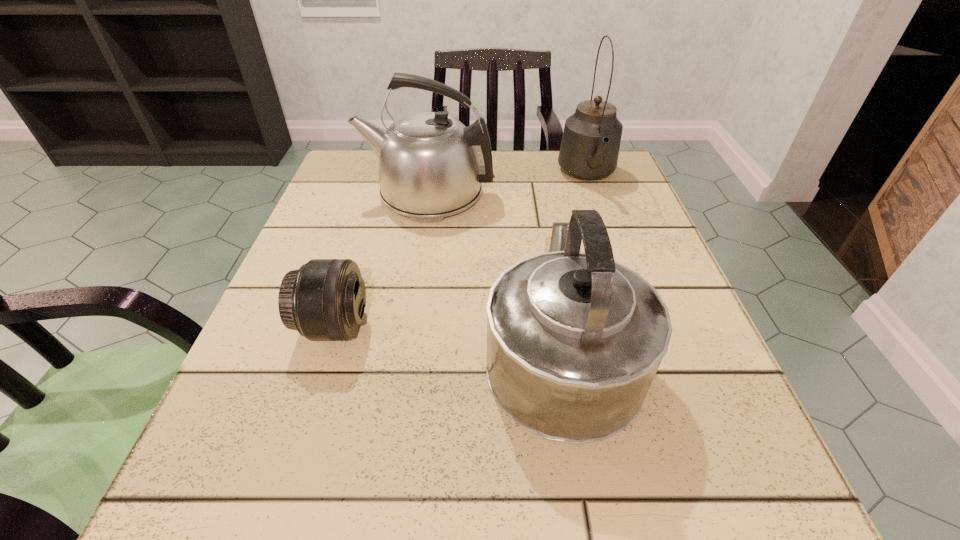
Locate an element on the screen. the nearest kettle is located at coordinates (574, 340).

Where is `telephoto lens`? This screenshot has height=540, width=960. telephoto lens is located at coordinates (324, 300).

Identify the location of vacant space located 0.080m with the spout at the front of the nearest kettle. The height and width of the screenshot is (540, 960). (544, 252).

The image size is (960, 540). Find the location of `vacant space located with the spout at the front of the nearest kettle`. vacant space located with the spout at the front of the nearest kettle is located at coordinates (531, 171).

This screenshot has height=540, width=960. In order to click on free space located 0.370m with the spout at the front of the nearest kettle in this screenshot , I will do (x=532, y=173).

Locate an element on the screen. Image resolution: width=960 pixels, height=540 pixels. free space located on the front-facing side of the shortest object is located at coordinates click(506, 327).

Identify the location of kettle situated at the left edge. This screenshot has width=960, height=540. [x=431, y=165].

At what (x,y) coordinates should I click in order to perform the action: click on telephoto lens that is at the left edge. Please return your answer as a coordinate pair (x, y). This screenshot has width=960, height=540. Looking at the image, I should click on (324, 300).

Locate an element on the screen. object that is at the far left corner is located at coordinates (431, 165).

The image size is (960, 540). Identify the location of object that is at the far right corner. (590, 145).